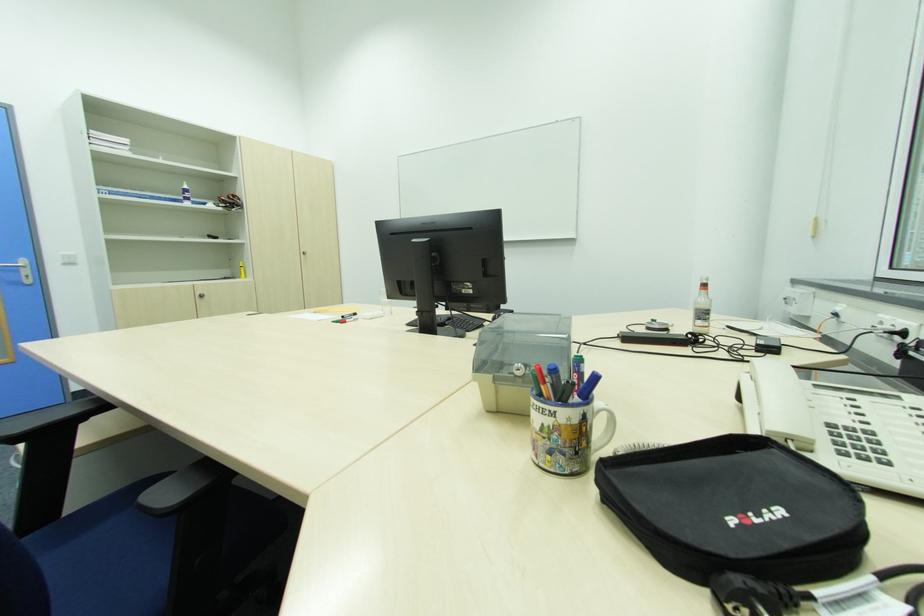
Find where to twist the orange bottle cap. Please return your answer as a coordinate pair (x, y).

(703, 286)